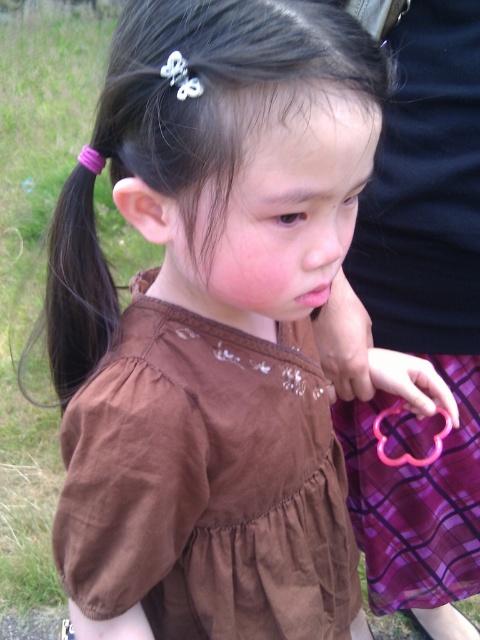
Question: Which point appears closest to the camera in this image?

Choices:
 (A) (410, 394)
 (B) (286, 580)
 (C) (393, 460)

Answer: (B)

Question: From the image, what is the correct spatial relationship of brown suede dress at center in relation to pink plastic scissors at lower right?

Choices:
 (A) left
 (B) right

Answer: (A)

Question: Which point appears farthest from the camera in this image?

Choices:
 (A) (336, 314)
 (B) (105, 260)
 (C) (240, 525)

Answer: (A)

Question: Can you confirm if purple elastic hairband at left is positioned to the left of matte pink skin at lower right?

Choices:
 (A) yes
 (B) no

Answer: (A)

Question: Does matte pink skin at lower right appear on the left side of pink rubber band at lower right?

Choices:
 (A) yes
 (B) no

Answer: (A)

Question: Which point is closer to the camera taking this photo?

Choices:
 (A) (336, 307)
 (B) (430, 458)

Answer: (B)